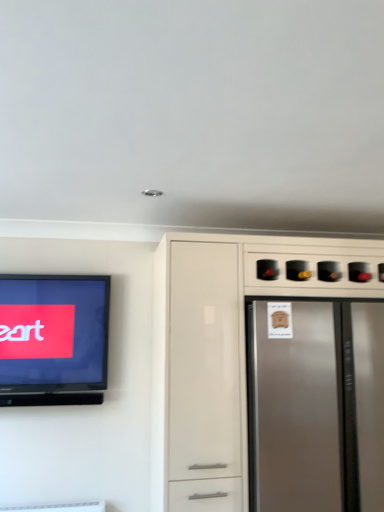
Question: Considering the positions of matte black television at left and satin white cabinet at right in the image, is matte black television at left wider or thinner than satin white cabinet at right?

Choices:
 (A) wide
 (B) thin

Answer: (B)

Question: Visually, is matte black television at left positioned to the left or to the right of satin white cabinet at right?

Choices:
 (A) right
 (B) left

Answer: (B)

Question: Which is nearer to the matte black television at left?

Choices:
 (A) satin white cabinet at right
 (B) satin silver refrigerator at right

Answer: (A)

Question: Estimate the real-world distances between objects in this image. Which object is farther from the satin silver refrigerator at right?

Choices:
 (A) satin white cabinet at right
 (B) matte black television at left

Answer: (B)